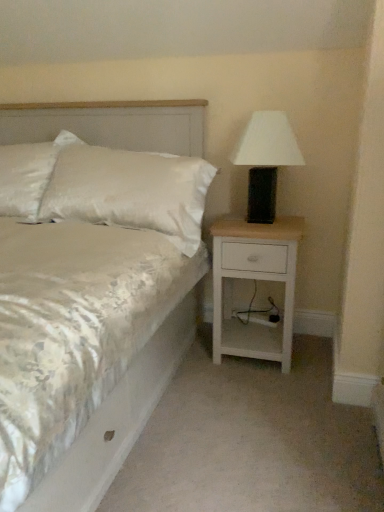
Locate an element on the screen. This screenshot has height=512, width=384. free point in front of white wood nightstand at right is located at coordinates (271, 395).